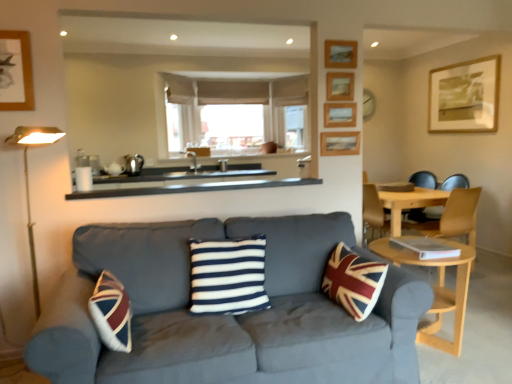
Question: Considering the relative positions of light wood round table at lower right and wooden picture frame at upper center, which is counted as the 3th picture frame, starting from the back, in the image provided, is light wood round table at lower right in front of wooden picture frame at upper center, which is counted as the 3th picture frame, starting from the back,?

Choices:
 (A) yes
 (B) no

Answer: (A)

Question: Is light wood round table at lower right at the right side of wooden picture frame at upper center, which ranks as the third picture frame in left-to-right order?

Choices:
 (A) no
 (B) yes

Answer: (B)

Question: Does light wood round table at lower right appear on the left side of wooden picture frame at upper center, which is counted as the 3th picture frame, starting from the back?

Choices:
 (A) no
 (B) yes

Answer: (A)

Question: Considering the relative positions of light wood round table at lower right and wooden picture frame at upper center, which is counted as the third picture frame, starting from the front, in the image provided, is light wood round table at lower right behind wooden picture frame at upper center, which is counted as the third picture frame, starting from the front,?

Choices:
 (A) yes
 (B) no

Answer: (B)

Question: Considering the relative sizes of light wood round table at lower right and wooden picture frame at upper center, which ranks as the third picture frame in left-to-right order, in the image provided, is light wood round table at lower right shorter than wooden picture frame at upper center, which ranks as the third picture frame in left-to-right order,?

Choices:
 (A) no
 (B) yes

Answer: (A)

Question: Considering their positions, is velvet blue couch at center located in front of or behind light brown wooden chair at right?

Choices:
 (A) front
 (B) behind

Answer: (A)

Question: Is velvet blue couch at center inside or outside of light brown wooden chair at right?

Choices:
 (A) inside
 (B) outside

Answer: (B)

Question: From a real-world perspective, is velvet blue couch at center positioned above or below light brown wooden chair at right?

Choices:
 (A) above
 (B) below

Answer: (A)

Question: Is point (311, 238) positioned closer to the camera than point (403, 225)?

Choices:
 (A) closer
 (B) farther

Answer: (A)

Question: Is black matte counter top at center to the left or to the right of wooden picture frame at upper right, marked as the 1th picture frame in a front-to-back arrangement, in the image?

Choices:
 (A) left
 (B) right

Answer: (A)

Question: From the image's perspective, relative to wooden picture frame at upper right, marked as the 1th picture frame in a front-to-back arrangement, is black matte counter top at center above or below?

Choices:
 (A) above
 (B) below

Answer: (B)

Question: Is black matte counter top at center in front of or behind wooden picture frame at upper right, marked as the 1th picture frame in a front-to-back arrangement, in the image?

Choices:
 (A) behind
 (B) front

Answer: (B)

Question: From a real-world perspective, is black matte counter top at center positioned above or below wooden picture frame at upper right, arranged as the 1th picture frame when viewed from the left?

Choices:
 (A) above
 (B) below

Answer: (B)

Question: Looking at their shapes, would you say light brown wooden chair at right is wider or thinner than light wood round table at lower right?

Choices:
 (A) thin
 (B) wide

Answer: (A)

Question: In the image, is light brown wooden chair at right positioned in front of or behind light wood round table at lower right?

Choices:
 (A) behind
 (B) front

Answer: (A)